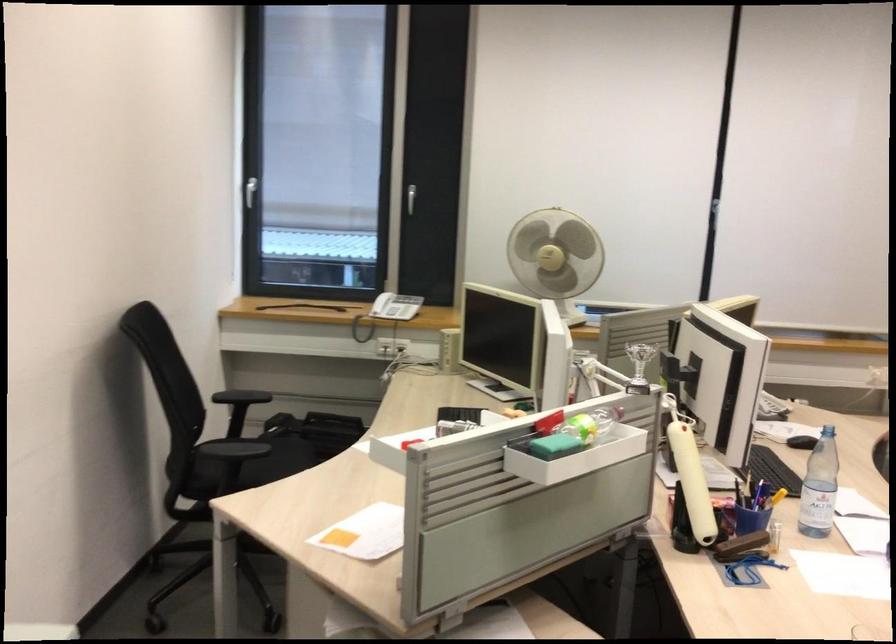
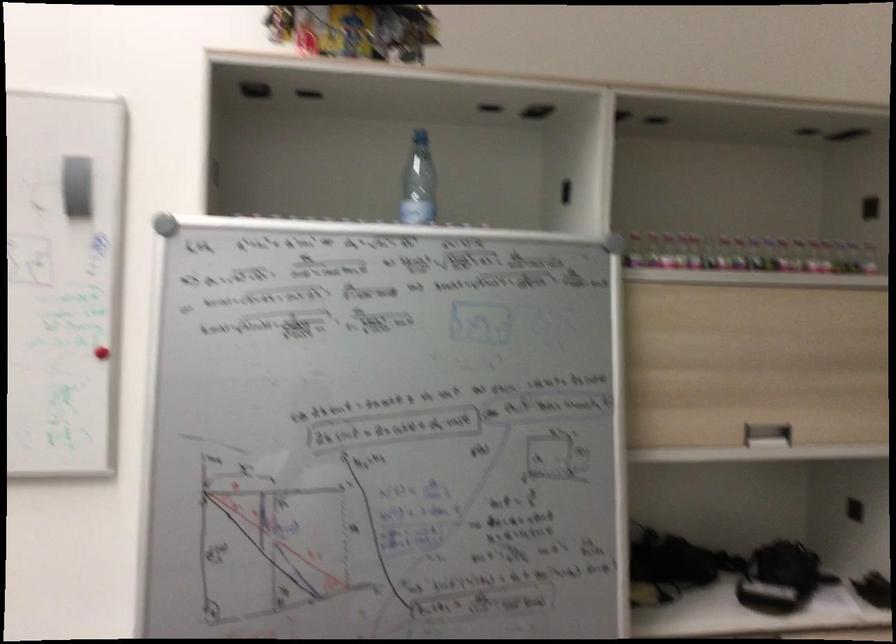
Question: The first image is from the beginning of the video and the second image is from the end. How did the camera likely rotate when shooting the video?

Choices:
 (A) Left
 (B) Right
 (C) Up
 (D) Down

Answer: (B)